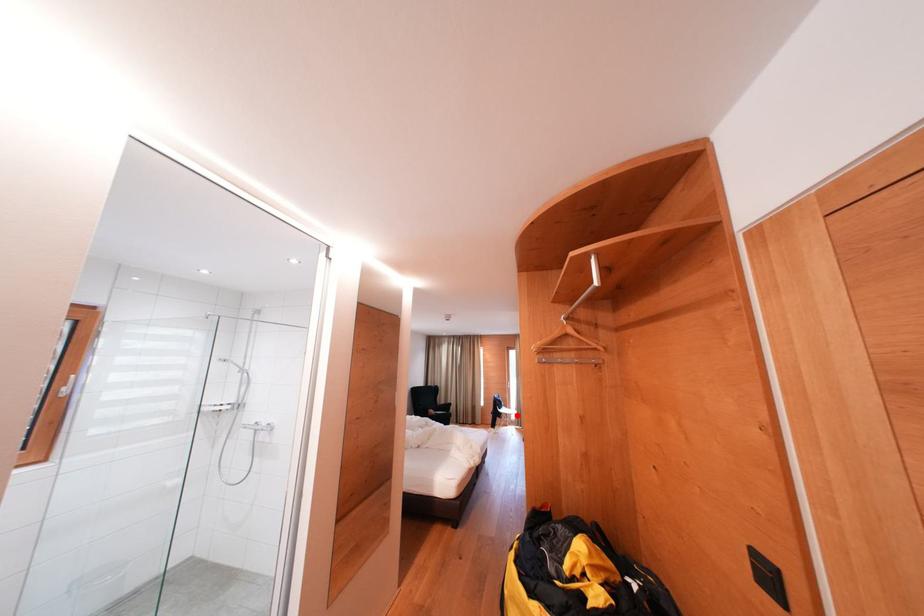
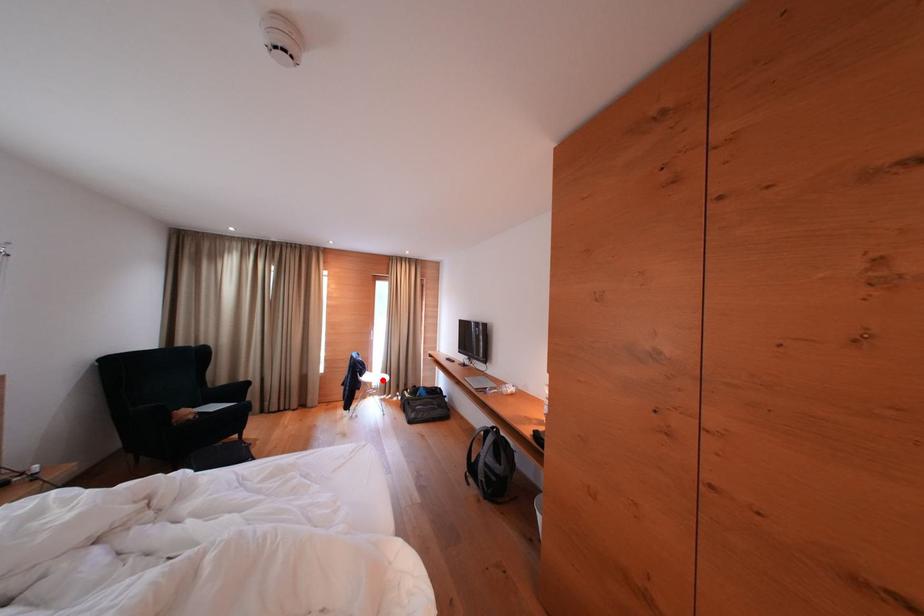
I am providing you with two images of the same scene from different viewpoints. A red point is marked on the first image and another point is marked on the second image. Is the red point in image1 aligned with the point shown in image2?

Yes